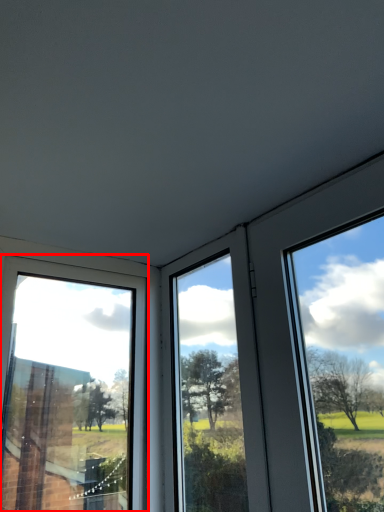
Question: From the image's perspective, where is window (annotated by the red box) located in relation to window in the image?

Choices:
 (A) above
 (B) below

Answer: (B)